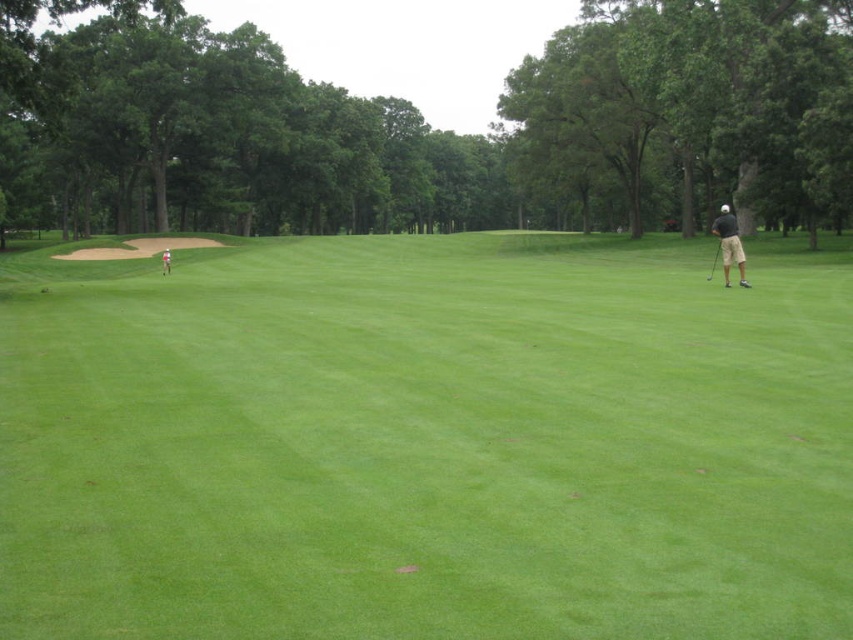
You are standing at the point labeled point (x=131, y=579) and want to walk towards the point labeled point (x=724, y=204). Will you pass in front of or behind the sand trap located on the left side of the midground?

The sand trap is located in the midground on the left side. Since point (x=131, y=579) is in front of point (x=724, y=204), walking from the former to the latter would mean moving towards a more distant area. Therefore, you would pass behind the sand trap as you move away from the foreground towards the midground.

You are a golfer standing at the tee and see both the black fabric golf club at right and the metallic silver golf club at right. Which one is positioned more to the right side?

The black fabric golf club at right is positioned more to the right side than the metallic silver golf club at right.